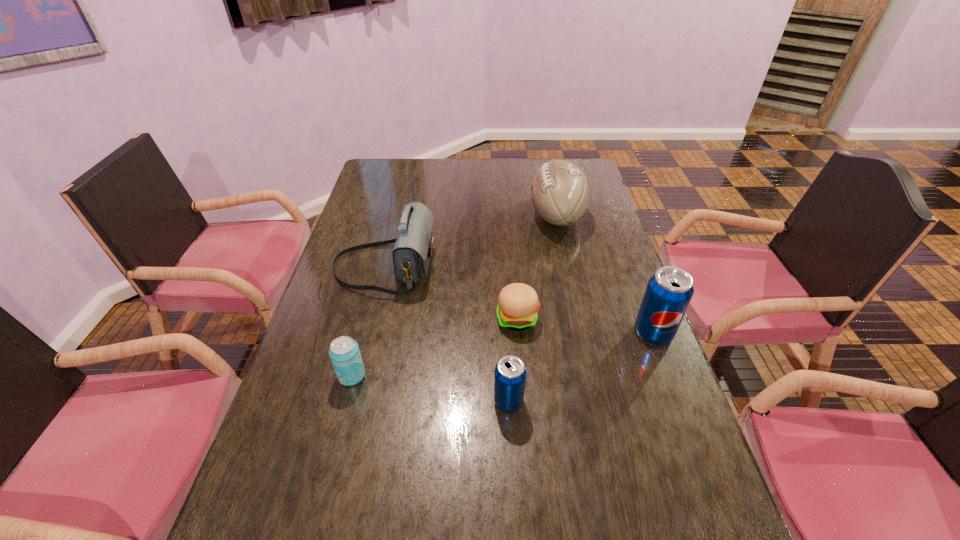
Considering the uniform spacing of pop sodas, where should an additional pop soda be positioned on the left? Please locate a free spot. Please provide its 2D coordinates. Your answer should be formatted as a tuple, i.e. [(x, y)], where the tuple contains the x and y coordinates of a point satisfying the conditions above.

[(313, 492)]